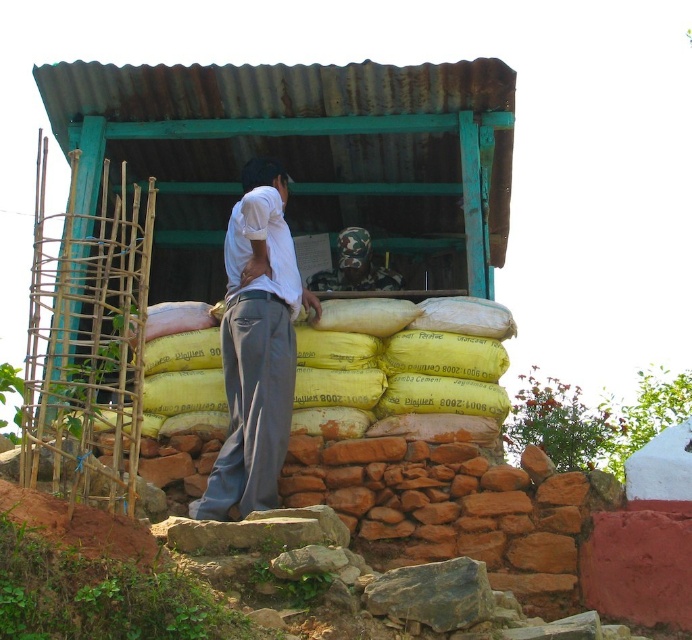
Which is more to the right, white cotton shirt at center or camouflage fabric at center?

Positioned to the right is camouflage fabric at center.

Who is shorter, white cotton shirt at center or camouflage fabric at center?

camouflage fabric at center is shorter.

Which is in front, point (284, 289) or point (354, 244)?

Positioned in front is point (284, 289).

Where is `white cotton shirt at center`? The height and width of the screenshot is (640, 692). white cotton shirt at center is located at coordinates (255, 346).

Is gray cotton pants at center bigger than camouflage fabric at center?

Yes, gray cotton pants at center is bigger than camouflage fabric at center.

Describe the element at coordinates (253, 404) in the screenshot. This screenshot has height=640, width=692. I see `gray cotton pants at center` at that location.

Where is `gray cotton pants at center`? The image size is (692, 640). gray cotton pants at center is located at coordinates (253, 404).

Does white cotton shirt at center have a lesser width compared to gray cotton pants at center?

Incorrect, white cotton shirt at center's width is not less than gray cotton pants at center's.

Which is above, white cotton shirt at center or gray cotton pants at center?

white cotton shirt at center

Who is more forward, [280,419] or [244,451]?

Positioned in front is point [244,451].

Locate an element on the screen. The width and height of the screenshot is (692, 640). white cotton shirt at center is located at coordinates (255, 346).